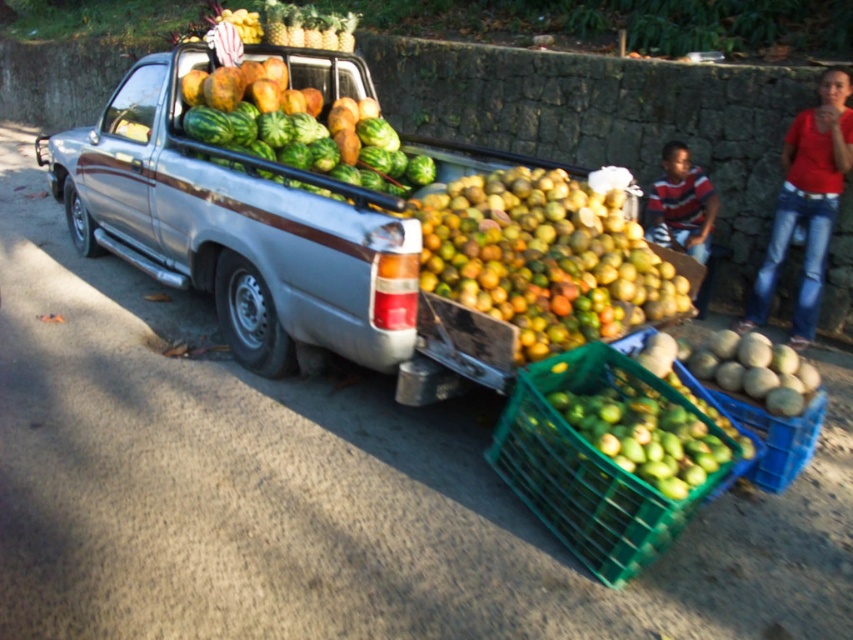
How distant is green plastic crate at lower center from green matte watermelons at center?

green plastic crate at lower center is 8.98 feet away from green matte watermelons at center.

Which is behind, point (537, 499) or point (283, 109)?

Positioned behind is point (283, 109).

Describe the element at coordinates (584, 468) in the screenshot. I see `green plastic crate at lower center` at that location.

Where is `green plastic crate at lower center`? The image size is (853, 640). green plastic crate at lower center is located at coordinates (584, 468).

Does red cotton shirt at right lie behind green matte melon at lower right?

Yes, red cotton shirt at right is further from the viewer.

Is point (798, 288) in front of point (762, 355)?

That is False.

The height and width of the screenshot is (640, 853). In order to click on red cotton shirt at right in this screenshot , I will do `click(807, 204)`.

Is green plastic crate at lower center to the right of green matte melon at lower right from the viewer's perspective?

Incorrect, green plastic crate at lower center is not on the right side of green matte melon at lower right.

Is point (618, 548) more distant than point (804, 392)?

No, it is in front of (804, 392).

What do you see at coordinates (584, 468) in the screenshot?
I see `green plastic crate at lower center` at bounding box center [584, 468].

The height and width of the screenshot is (640, 853). I want to click on green plastic crate at lower center, so pos(584,468).